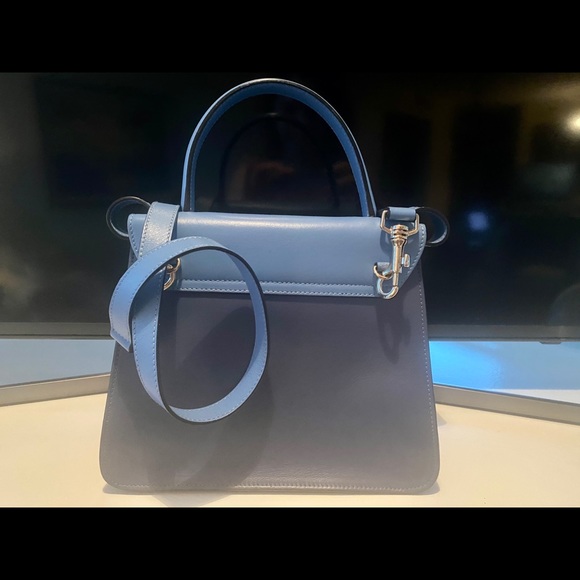
Locate an element on the screen. The image size is (580, 580). table is located at coordinates (514, 478).